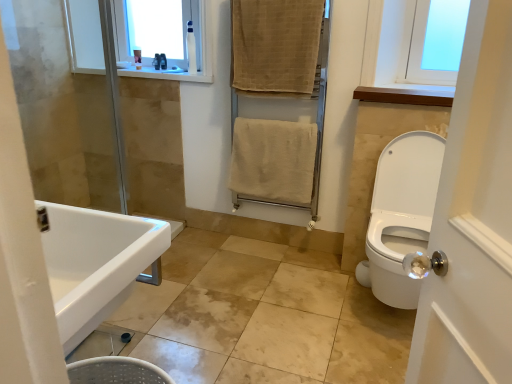
Find the location of a particular element. The width and height of the screenshot is (512, 384). vacant space situated above transparent plastic bottle at upper center (from a real-world perspective) is located at coordinates (146, 1).